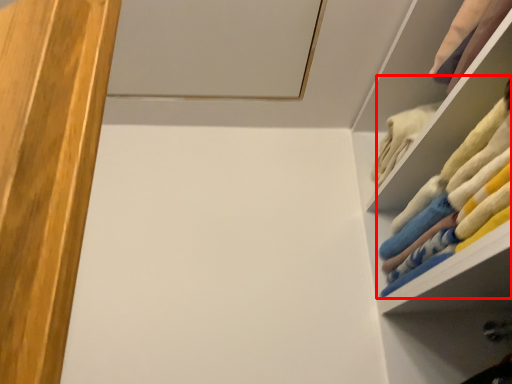
Question: Observing the image, what is the correct spatial positioning of laundry (annotated by the red box) in reference to cabinet?

Choices:
 (A) left
 (B) right

Answer: (B)